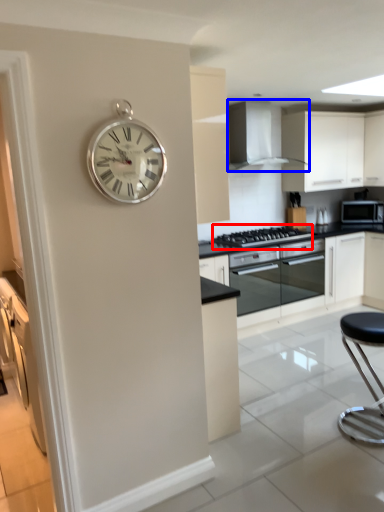
Question: Which of the following is the closest to the observer, gas stove (highlighted by a red box) or home appliance (highlighted by a blue box)?

Choices:
 (A) gas stove
 (B) home appliance

Answer: (B)